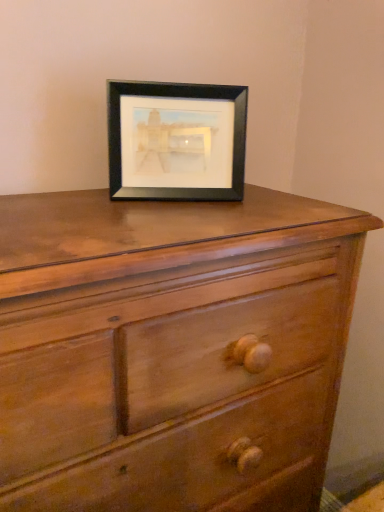
Question: Does matte wood chest of drawers at center come behind black matte picture frame at upper center?

Choices:
 (A) no
 (B) yes

Answer: (A)

Question: Does matte wood chest of drawers at center have a lesser height compared to black matte picture frame at upper center?

Choices:
 (A) no
 (B) yes

Answer: (A)

Question: Is matte wood chest of drawers at center next to black matte picture frame at upper center?

Choices:
 (A) yes
 (B) no

Answer: (B)

Question: Is matte wood chest of drawers at center turned away from black matte picture frame at upper center?

Choices:
 (A) no
 (B) yes

Answer: (A)

Question: Does matte wood chest of drawers at center have a smaller size compared to black matte picture frame at upper center?

Choices:
 (A) yes
 (B) no

Answer: (B)

Question: Is black matte picture frame at upper center completely or partially inside matte wood chest of drawers at center?

Choices:
 (A) yes
 (B) no

Answer: (B)

Question: From the image's perspective, is black matte picture frame at upper center below matte wood chest of drawers at center?

Choices:
 (A) no
 (B) yes

Answer: (A)

Question: Does black matte picture frame at upper center appear on the right side of matte wood chest of drawers at center?

Choices:
 (A) yes
 (B) no

Answer: (A)

Question: Does black matte picture frame at upper center touch matte wood chest of drawers at center?

Choices:
 (A) yes
 (B) no

Answer: (B)

Question: Does black matte picture frame at upper center have a lesser height compared to matte wood chest of drawers at center?

Choices:
 (A) yes
 (B) no

Answer: (A)

Question: Does black matte picture frame at upper center have a smaller size compared to matte wood chest of drawers at center?

Choices:
 (A) yes
 (B) no

Answer: (A)

Question: From a real-world perspective, is black matte picture frame at upper center under matte wood chest of drawers at center?

Choices:
 (A) no
 (B) yes

Answer: (A)

Question: From a real-world perspective, is matte wood chest of drawers at center positioned above or below black matte picture frame at upper center?

Choices:
 (A) below
 (B) above

Answer: (A)